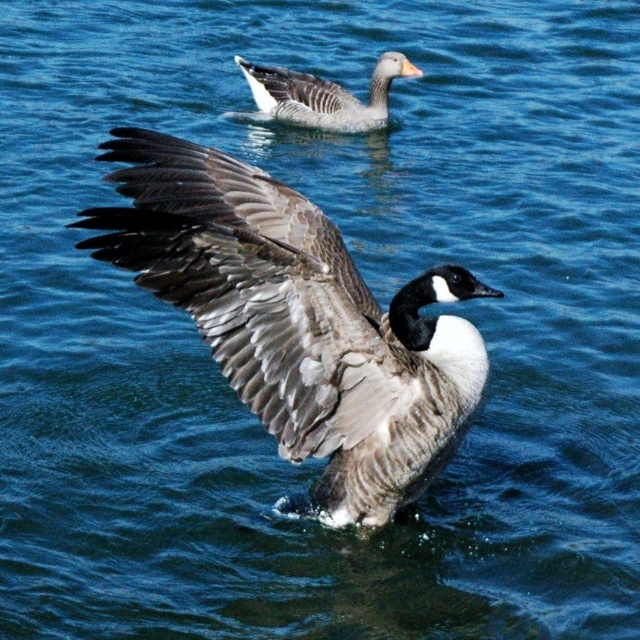
Question: Does gray-brown feathered goose at center appear on the right side of gray matte duck at upper center?

Choices:
 (A) yes
 (B) no

Answer: (B)

Question: Is gray-brown feathered goose at center closer to the viewer compared to gray matte duck at upper center?

Choices:
 (A) no
 (B) yes

Answer: (B)

Question: Can you confirm if gray-brown feathered goose at center is bigger than gray matte duck at upper center?

Choices:
 (A) yes
 (B) no

Answer: (A)

Question: Which point is closer to the camera?

Choices:
 (A) gray matte duck at upper center
 (B) gray-brown feathered goose at center

Answer: (B)